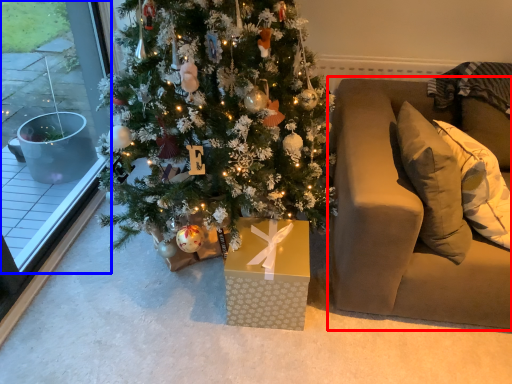
Question: Which point is further to the camera, studio couch (highlighted by a red box) or window (highlighted by a blue box)?

Choices:
 (A) studio couch
 (B) window

Answer: (A)